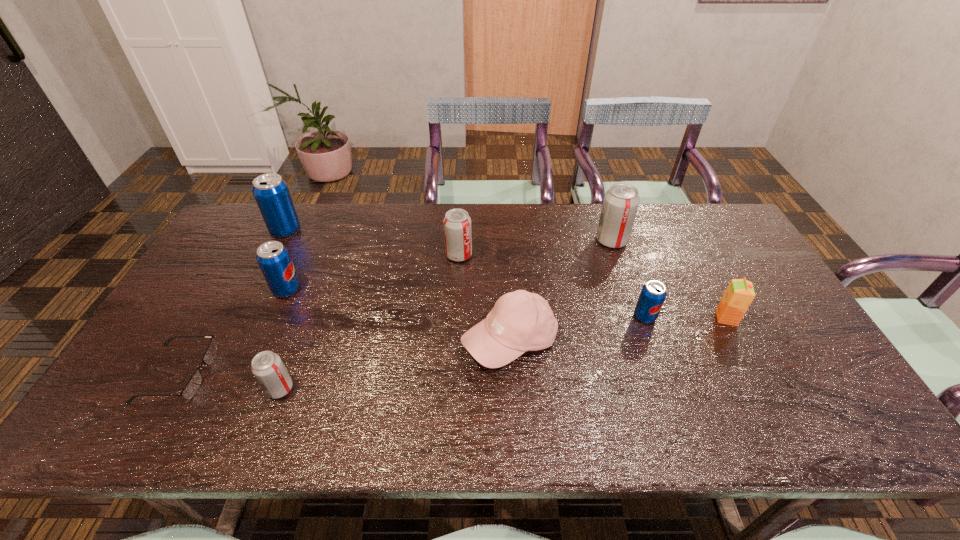
The image size is (960, 540). I want to click on blank space that satisfies the following two spatial constraints: 1. on the front side of the farthest blue pop soda; 2. on the right side of the nearest gray soda can, so click(x=204, y=389).

You are a GUI agent. You are given a task and a screenshot of the screen. Output one action in this format:
    pyautogui.click(x=<x>, y=<y>)
    Task: Click on the vacant region that satisfies the following two spatial constraints: 1. on the front side of the second nearest blue pop soda; 2. on the front-facing side of the black spectacles
    
    Given the screenshot: What is the action you would take?
    pos(250,373)